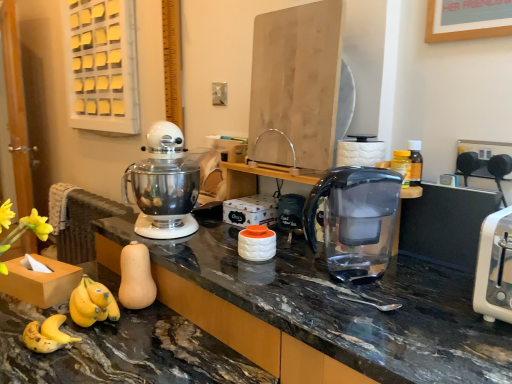
Question: Is transparent plastic water filter pitcher at center far from marble black countertop at lower left?

Choices:
 (A) no
 (B) yes

Answer: (A)

Question: From a real-world perspective, is transparent plastic water filter pitcher at center under marble black countertop at lower left?

Choices:
 (A) yes
 (B) no

Answer: (B)

Question: Can you confirm if transparent plastic water filter pitcher at center is smaller than marble black countertop at lower left?

Choices:
 (A) yes
 (B) no

Answer: (A)

Question: Can you confirm if transparent plastic water filter pitcher at center is positioned to the left of marble black countertop at lower left?

Choices:
 (A) yes
 (B) no

Answer: (B)

Question: From the image's perspective, is transparent plastic water filter pitcher at center on marble black countertop at lower left?

Choices:
 (A) yes
 (B) no

Answer: (A)

Question: Considering their positions, is white plastic toaster at right located in front of or behind transparent plastic water filter pitcher at center?

Choices:
 (A) behind
 (B) front

Answer: (B)

Question: In terms of height, does white plastic toaster at right look taller or shorter compared to transparent plastic water filter pitcher at center?

Choices:
 (A) short
 (B) tall

Answer: (A)

Question: Would you say white plastic toaster at right is to the left or to the right of transparent plastic water filter pitcher at center in the picture?

Choices:
 (A) left
 (B) right

Answer: (B)

Question: Looking at the image, does white plastic toaster at right seem bigger or smaller compared to transparent plastic water filter pitcher at center?

Choices:
 (A) big
 (B) small

Answer: (B)

Question: In terms of height, does marble black countertop at lower left look taller or shorter compared to matte black jar at center?

Choices:
 (A) short
 (B) tall

Answer: (B)

Question: Is marble black countertop at lower left wider or thinner than matte black jar at center?

Choices:
 (A) thin
 (B) wide

Answer: (B)

Question: From a real-world perspective, is marble black countertop at lower left positioned above or below matte black jar at center?

Choices:
 (A) below
 (B) above

Answer: (A)

Question: Is marble black countertop at lower left situated inside matte black jar at center or outside?

Choices:
 (A) inside
 (B) outside

Answer: (B)

Question: Which is correct: transparent plastic water filter pitcher at center is inside white plastic toaster at right, or outside of it?

Choices:
 (A) outside
 (B) inside

Answer: (A)

Question: Considering the relative positions of transparent plastic water filter pitcher at center and white plastic toaster at right in the image provided, is transparent plastic water filter pitcher at center to the left or to the right of white plastic toaster at right?

Choices:
 (A) right
 (B) left

Answer: (B)